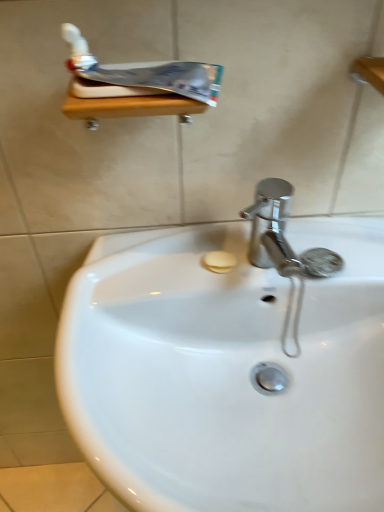
Question: Considering the positions of point (84, 53) and point (148, 301), is point (84, 53) closer or farther from the camera than point (148, 301)?

Choices:
 (A) closer
 (B) farther

Answer: (A)

Question: Considering the positions of white glossy toothpaste at upper left and white glossy sink at center in the image, is white glossy toothpaste at upper left taller or shorter than white glossy sink at center?

Choices:
 (A) short
 (B) tall

Answer: (A)

Question: Considering their positions, is white glossy toothpaste at upper left located in front of or behind white glossy sink at center?

Choices:
 (A) front
 (B) behind

Answer: (B)

Question: Based on their positions, is white glossy sink at center located to the left or right of white glossy toothpaste at upper left?

Choices:
 (A) right
 (B) left

Answer: (A)

Question: Looking at their shapes, would you say white glossy sink at center is wider or thinner than white glossy toothpaste at upper left?

Choices:
 (A) wide
 (B) thin

Answer: (A)

Question: In terms of height, does white glossy sink at center look taller or shorter compared to white glossy toothpaste at upper left?

Choices:
 (A) tall
 (B) short

Answer: (A)

Question: Which is correct: white glossy sink at center is inside white glossy toothpaste at upper left, or outside of it?

Choices:
 (A) outside
 (B) inside

Answer: (A)